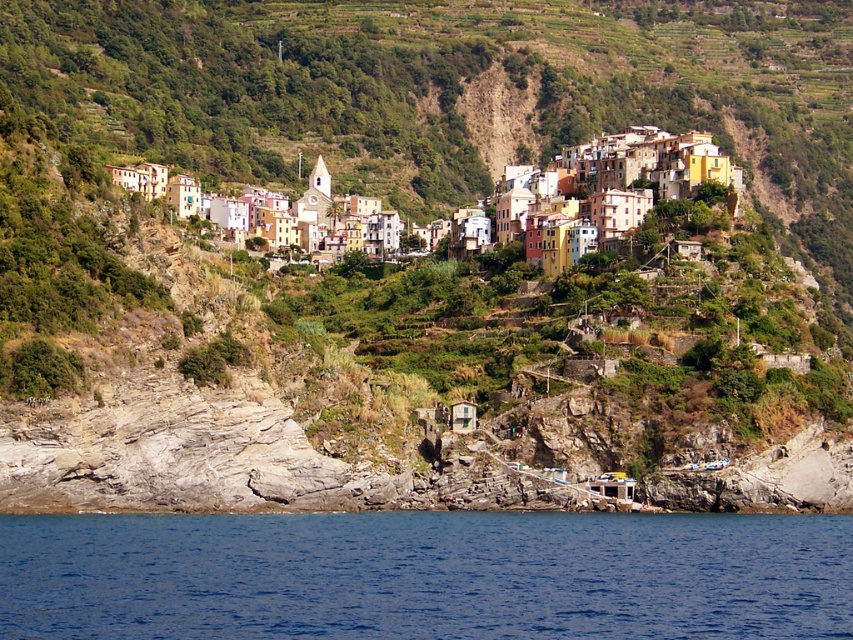
You are standing at the base of the hill in the coastal village and want to reach the highest point. Which object, the blue liquid water at lower center or the multicolored stone buildings at upper center, is closer to your current position?

The blue liquid water at lower center is closer to your current position because it is not as tall as the multicolored stone buildings at upper center, which are higher up the hill.

You are a tourist standing at the base of the hill in the coastal village. You want to take a photo that includes both the blue liquid water at lower center and the multicolored stone buildings at upper center in the same frame. Given that your camera has a 50mm lens, which has a field of view of approximately 46 degrees, can you capture both objects in a single shot without moving your position? Please explain your reasoning.

The blue liquid water at lower center and multicolored stone buildings at upper center are 181.19 feet apart from each other. To determine if they can fit in a 46 degree field of view, we can calculate the angular separation between them. However, without knowing the distance from the camera to the objects, it is impossible to accurately determine if the 181.19 feet separation falls within the 46 degree field of view. Additional information about the distance from the observer to the objects is required to